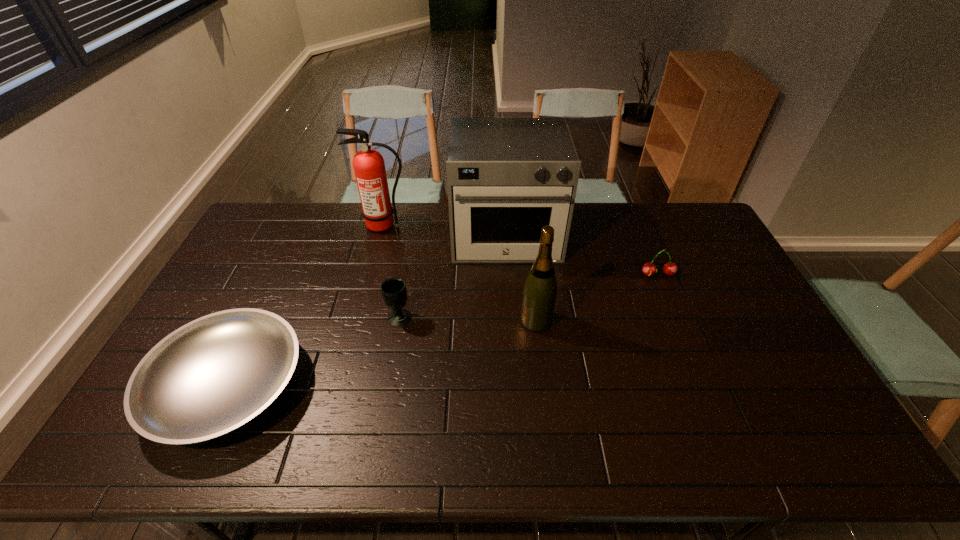
The image size is (960, 540). Identify the location of toaster oven. (507, 178).

This screenshot has width=960, height=540. What are the coordinates of `fire extinguisher` in the screenshot? It's located at (369, 167).

The image size is (960, 540). What are the coordinates of `wine bottle` in the screenshot? It's located at (x=540, y=289).

You are a GUI agent. You are given a task and a screenshot of the screen. Output one action in this format:
    pyautogui.click(x=<x>, y=<y>)
    Task: Click on the chalice
    The width and height of the screenshot is (960, 540).
    Given the screenshot: What is the action you would take?
    coord(394,292)

In order to click on the third farthest object in this screenshot , I will do `click(670, 268)`.

Locate an element on the screen. cherry is located at coordinates (670, 268).

You are a GUI agent. You are given a task and a screenshot of the screen. Output one action in this format:
    pyautogui.click(x=<x>, y=<y>)
    Task: Click on the shortest object
    The image size is (960, 540).
    Given the screenshot: What is the action you would take?
    pyautogui.click(x=213, y=375)

At what (x,y) coordinates should I click in order to perform the action: click on bedpan. Please return your answer as a coordinate pair (x, y). Looking at the image, I should click on (213, 375).

At what (x,y) coordinates should I click in order to perform the action: click on blank area located 0.260m on the front panel of the toaster oven. Please return your answer as a coordinate pair (x, y). The image size is (960, 540). Looking at the image, I should click on (513, 327).

In order to click on vacant space positioned on the handle side of the fire extinguisher in this screenshot , I will do `click(378, 246)`.